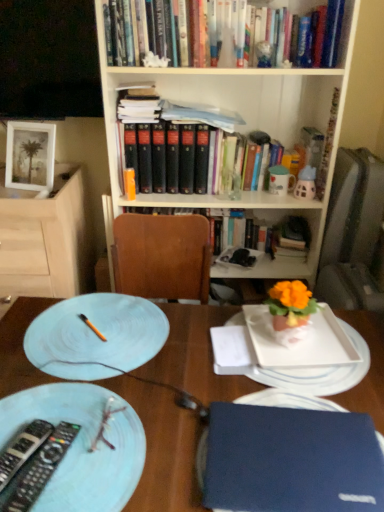
You are a GUI agent. You are given a task and a screenshot of the screen. Output one action in this format:
    pyautogui.click(x=<x>, y=<y>)
    Task: Click on the free point above blue hardcover book at lower right (from a real-world perspective)
    This screenshot has width=384, height=512.
    Given the screenshot: What is the action you would take?
    [297, 454]